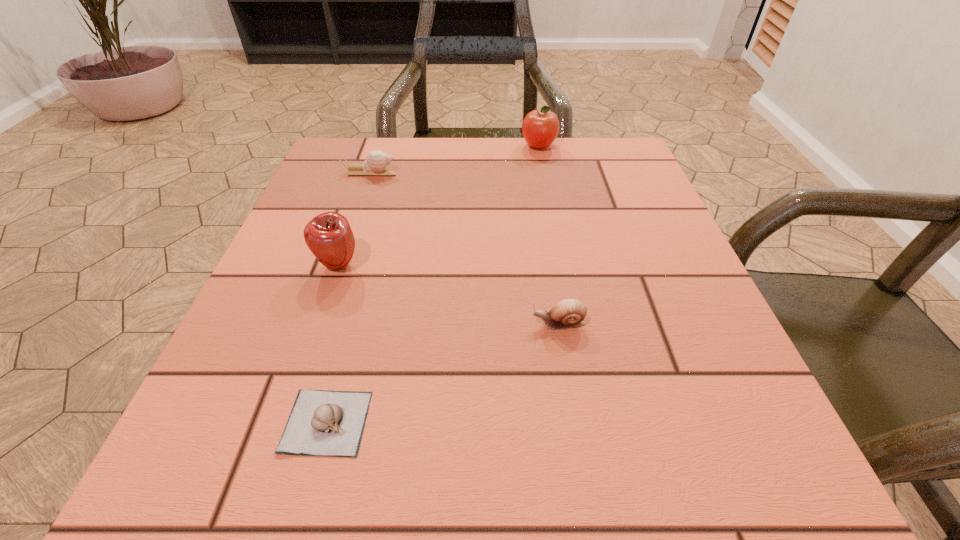
Identify the location of blank region between the nearest object and the left escargot. (348, 297).

I want to click on free area in between the fourth farthest object and the farthest object, so click(549, 235).

You are a GUI agent. You are given a task and a screenshot of the screen. Output one action in this format:
    pyautogui.click(x=<x>, y=<y>)
    Task: Click on the fourth closest object to the second nearest object
    The width and height of the screenshot is (960, 540).
    Given the screenshot: What is the action you would take?
    pyautogui.click(x=540, y=128)

Where is `object identified as the second closest to the left apple`? object identified as the second closest to the left apple is located at coordinates (376, 162).

Image resolution: width=960 pixels, height=540 pixels. Identify the location of free region that satisfies the following two spatial constraints: 1. on the back side of the shortest object; 2. on the shell of the left escargot. point(394,172).

The height and width of the screenshot is (540, 960). I want to click on vacant space that satisfies the following two spatial constraints: 1. on the back side of the left apple; 2. on the right side of the farthest object, so click(379, 146).

Where is `free spot that satisfies the following two spatial constraints: 1. on the shell of the second farthest object; 2. on the right side of the nearest object`? free spot that satisfies the following two spatial constraints: 1. on the shell of the second farthest object; 2. on the right side of the nearest object is located at coordinates (285, 422).

The height and width of the screenshot is (540, 960). Find the location of `vacant region that satisfies the following two spatial constraints: 1. on the shell of the nearest object; 2. on the right side of the fourth nearest object`. vacant region that satisfies the following two spatial constraints: 1. on the shell of the nearest object; 2. on the right side of the fourth nearest object is located at coordinates (285, 422).

The image size is (960, 540). In order to click on blank space that satisfies the following two spatial constraints: 1. on the shell of the left escargot; 2. on the back side of the shortest object in this screenshot , I will do `click(285, 422)`.

Where is `vacant space that satisfies the following two spatial constraints: 1. on the front side of the nearest object; 2. on the left side of the third nearest object`? vacant space that satisfies the following two spatial constraints: 1. on the front side of the nearest object; 2. on the left side of the third nearest object is located at coordinates (284, 422).